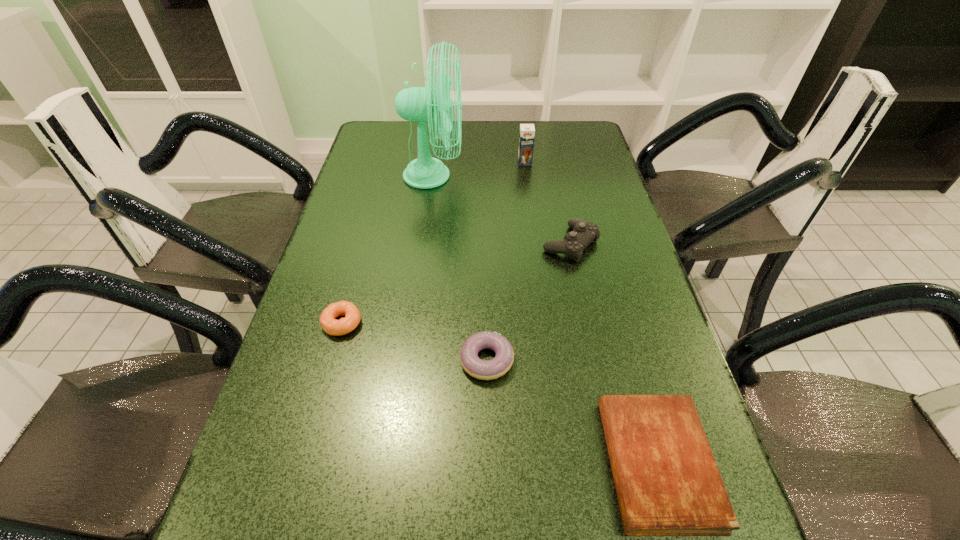
The height and width of the screenshot is (540, 960). I want to click on free space between the chocolate milk and the third object from left to right, so click(506, 261).

This screenshot has width=960, height=540. In order to click on free space between the leftmost object and the chocolate milk in this screenshot , I will do `click(434, 242)`.

Identify the location of unoccupied position between the control and the chocolate milk. (547, 203).

Locate an element on the screen. This screenshot has height=540, width=960. empty space between the chocolate milk and the right doughnut is located at coordinates (506, 261).

Where is `free space between the right doughnut and the fourth nearest object`? The width and height of the screenshot is (960, 540). free space between the right doughnut and the fourth nearest object is located at coordinates (529, 302).

Find the location of `free spot between the chocolate milk and the leftmost object`. free spot between the chocolate milk and the leftmost object is located at coordinates (434, 242).

Choose which object is the fourth nearest neighbor to the chocolate milk. Please provide its 2D coordinates. Your answer should be formatted as a tuple, i.e. [(x, y)], where the tuple contains the x and y coordinates of a point satisfying the conditions above.

[(328, 323)]

What are the coordinates of `the fourth closest object to the leftmost object` in the screenshot? It's located at (667, 481).

Identify the location of free space that satisfies the following two spatial constraints: 1. in front of the right doughnut to blow air; 2. on the left side of the tallest object. This screenshot has height=540, width=960. (410, 360).

Locate an element on the screen. free point that satisfies the following two spatial constraints: 1. in front of the fifth object from right to left to blow air; 2. on the right side of the fourth object from right to left is located at coordinates (410, 360).